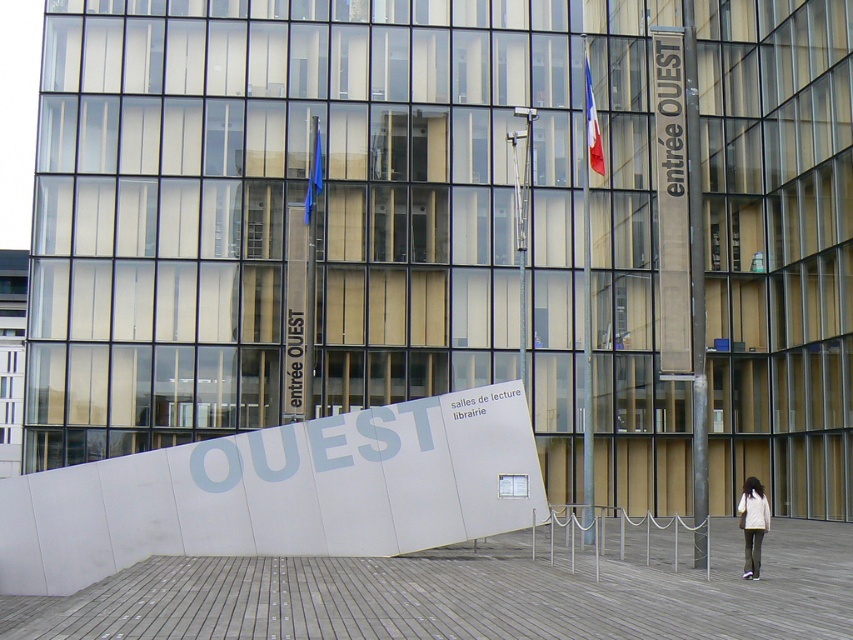
Is white cotton jacket at lower right taller than french flag at upper center?

No.

In the scene shown: Which is more to the left, white cotton jacket at lower right or french flag at upper center?

french flag at upper center

Is point (769, 524) in front of point (590, 148)?

Yes, it is in front of point (590, 148).

Identify the location of white cotton jacket at lower right. (752, 524).

Between white cotton jacket at lower right and blue fabric flag at center, which one has less height?

Standing shorter between the two is blue fabric flag at center.

Is point (750, 486) farther from camera compared to point (309, 204)?

No, it is in front of (309, 204).

Where is `white cotton jacket at lower right`? The height and width of the screenshot is (640, 853). white cotton jacket at lower right is located at coordinates (752, 524).

Between french flag at upper center and blue fabric flag at center, which one has less height?

blue fabric flag at center is shorter.

Which is below, french flag at upper center or blue fabric flag at center?

blue fabric flag at center is lower down.

Between point (601, 161) and point (316, 125), which one is positioned in front?

Point (601, 161)

Identify the location of french flag at upper center. The width and height of the screenshot is (853, 640). pyautogui.click(x=592, y=124).